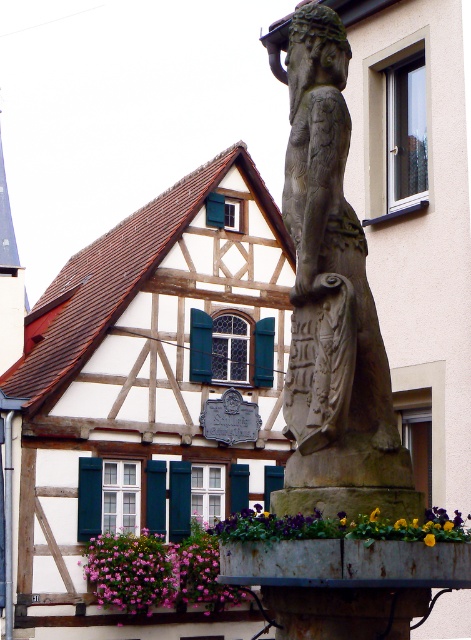
Is stone statue at center wider than pink fabric flowers at lower left?

No.

Does stone statue at center have a lesser width compared to pink fabric flowers at lower left?

Yes, stone statue at center is thinner than pink fabric flowers at lower left.

Is point (333, 378) closer to camera compared to point (222, 600)?

That is True.

The image size is (471, 640). I want to click on stone statue at center, so tap(332, 304).

Does purple fabric flower at center come in front of green painted wood shutter at center?

Yes, purple fabric flower at center is closer to the viewer.

Is purple fabric flower at center further to the viewer compared to green painted wood shutter at center?

No.

Which is behind, point (343, 522) or point (162, 470)?

Positioned behind is point (162, 470).

Where is `purple fabric flower at center`? The image size is (471, 640). purple fabric flower at center is located at coordinates (341, 525).

Is pink fabric flowers at lower left shorter than green painted wood shutter at center?

In fact, pink fabric flowers at lower left may be taller than green painted wood shutter at center.

Does point (186, 541) come farther from viewer compared to point (159, 531)?

Yes.

This screenshot has height=640, width=471. What are the coordinates of `pink fabric flowers at lower left` in the screenshot? It's located at (157, 572).